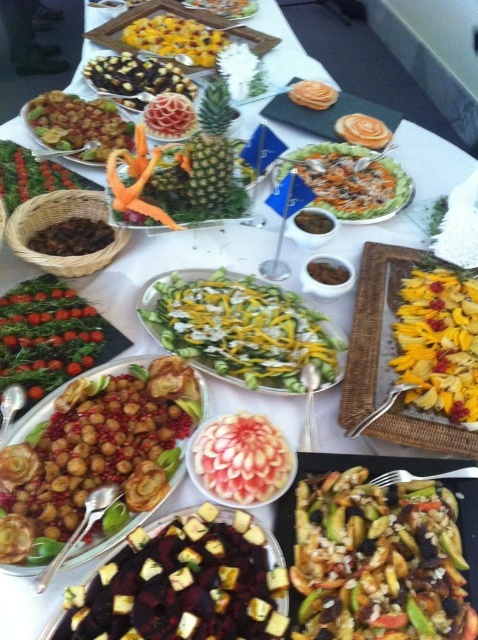
Question: Does carved pineapple at center appear on the right side of orange peel at center?

Choices:
 (A) no
 (B) yes

Answer: (A)

Question: Is yellow pineapple at center thinner than yellow fruit at center?

Choices:
 (A) yes
 (B) no

Answer: (A)

Question: Based on their relative distances, which object is nearer to the carved pineapple at center?

Choices:
 (A) dark brown/roasted vegetables at center
 (B) brown matte dried fruits at center

Answer: (B)

Question: Can you confirm if yellow pineapple at center is positioned to the right of green pineapple at center?

Choices:
 (A) no
 (B) yes

Answer: (B)

Question: Which of these objects is positioned farthest from the matte brown nuts at center?

Choices:
 (A) brown crispy pastry at center
 (B) chocolate cake at center

Answer: (A)

Question: Which of these objects is positioned farthest from the green leafy vegetable at center?

Choices:
 (A) dark brown/roasted vegetables at center
 (B) yellow pineapple at center
 (C) orange spiral cheese at center
 (D) matte brown nuts at center

Answer: (C)